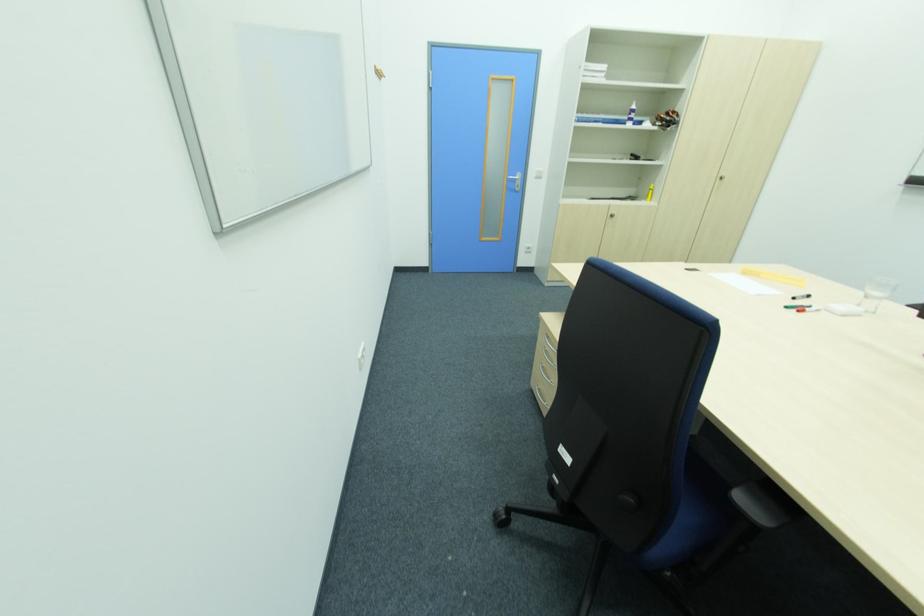
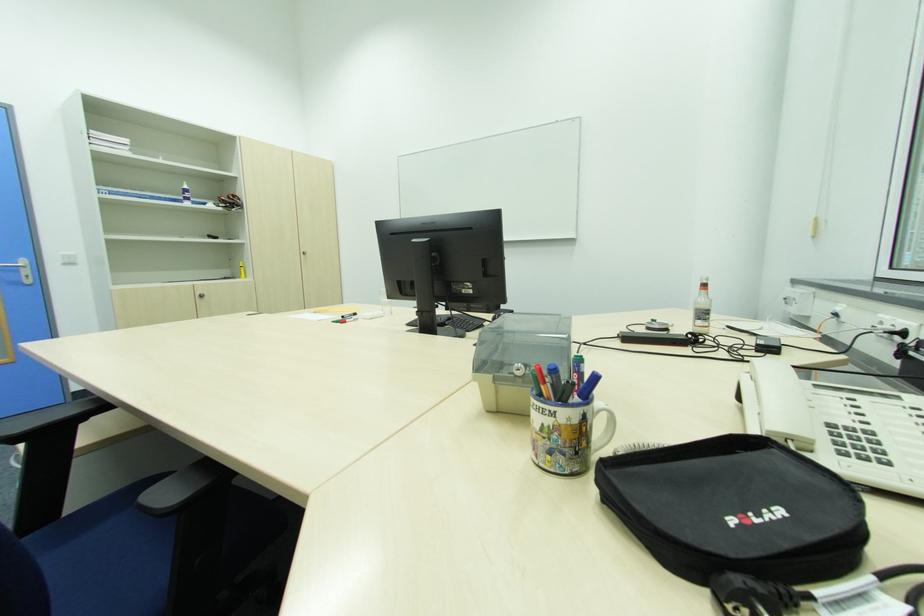
Find the pixel in the second image that matches point (649, 199) in the first image.

(244, 277)